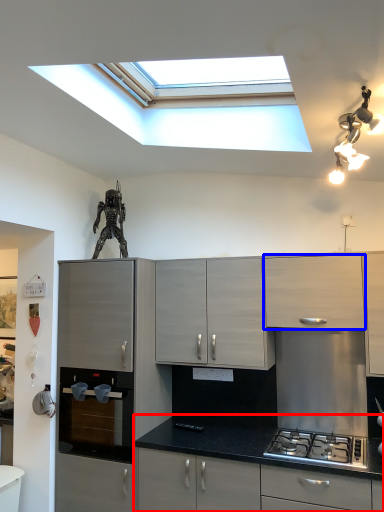
Question: Which object appears farthest to the camera in this image, cabinetry (highlighted by a red box) or cabinetry (highlighted by a blue box)?

Choices:
 (A) cabinetry
 (B) cabinetry

Answer: (B)